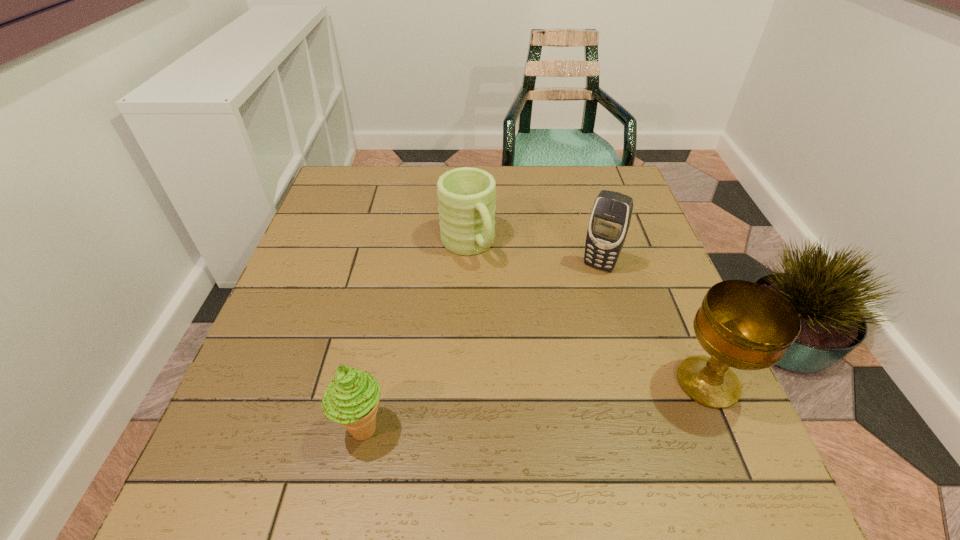
Locate an element on the screen. The image size is (960, 540). vacant space on the desktop that is between the leftmost object and the rightmost object and is positioned on the front face of the cellular telephone is located at coordinates (532, 406).

This screenshot has width=960, height=540. I want to click on free space on the desktop that is between the icecream and the rightmost object and is positioned on the side of the second object from left to right with the handle, so click(575, 400).